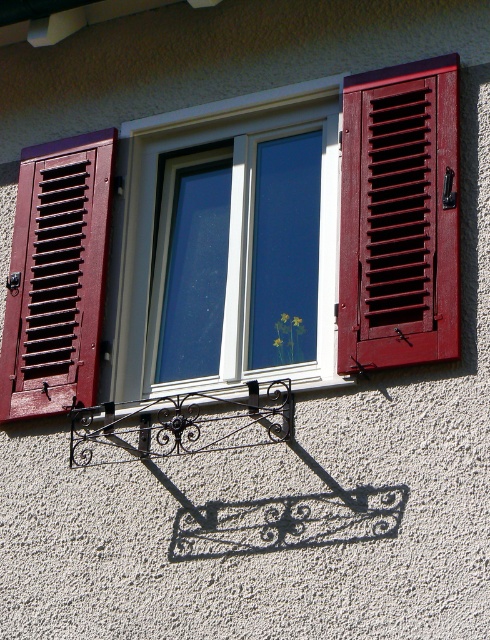
Question: Is matte white window frame at center wider than matte wood shutter at left?

Choices:
 (A) no
 (B) yes

Answer: (B)

Question: Among these objects, which one is farthest from the camera?

Choices:
 (A) matte glass window at center
 (B) matte white window frame at center
 (C) matte wood shutter at right

Answer: (A)

Question: Does matte glass window at center have a larger size compared to matte wood shutter at right?

Choices:
 (A) no
 (B) yes

Answer: (B)

Question: Which point appears farthest from the camera in this image?

Choices:
 (A) (372, 163)
 (B) (386, 104)

Answer: (B)

Question: Does matte white window frame at center lie behind matte wood shutter at right?

Choices:
 (A) yes
 (B) no

Answer: (A)

Question: Which point is farther from the camera taking this photo?

Choices:
 (A) (448, 230)
 (B) (419, 292)
 (C) (25, 401)

Answer: (C)